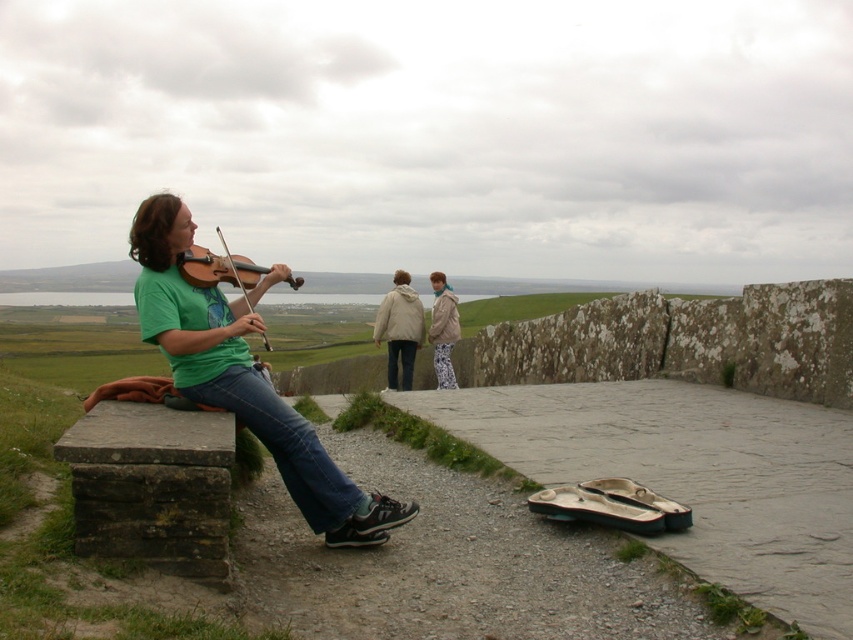
Can you confirm if light beige jacket at center is taller than patterned fabric jacket at center?

Yes, light beige jacket at center is taller than patterned fabric jacket at center.

Describe the element at coordinates (399, 328) in the screenshot. I see `light beige jacket at center` at that location.

This screenshot has height=640, width=853. I want to click on light beige jacket at center, so click(399, 328).

Based on the photo, which of these two, patterned fabric jacket at center or jeans at center, stands taller?

patterned fabric jacket at center is taller.

Between point (440, 346) and point (404, 385), which one is positioned behind?

Point (440, 346)

Which is in front, point (437, 352) or point (405, 344)?

Positioned in front is point (405, 344).

Locate an element on the screen. This screenshot has height=640, width=853. patterned fabric jacket at center is located at coordinates (444, 330).

Does jeans at center have a larger size compared to blue denim jeans at center?

Indeed, jeans at center has a larger size compared to blue denim jeans at center.

Does jeans at center have a greater height compared to blue denim jeans at center?

Indeed, jeans at center has a greater height compared to blue denim jeans at center.

Is point (396, 346) positioned after point (440, 346)?

No, it is not.

Locate an element on the screen. jeans at center is located at coordinates (401, 362).